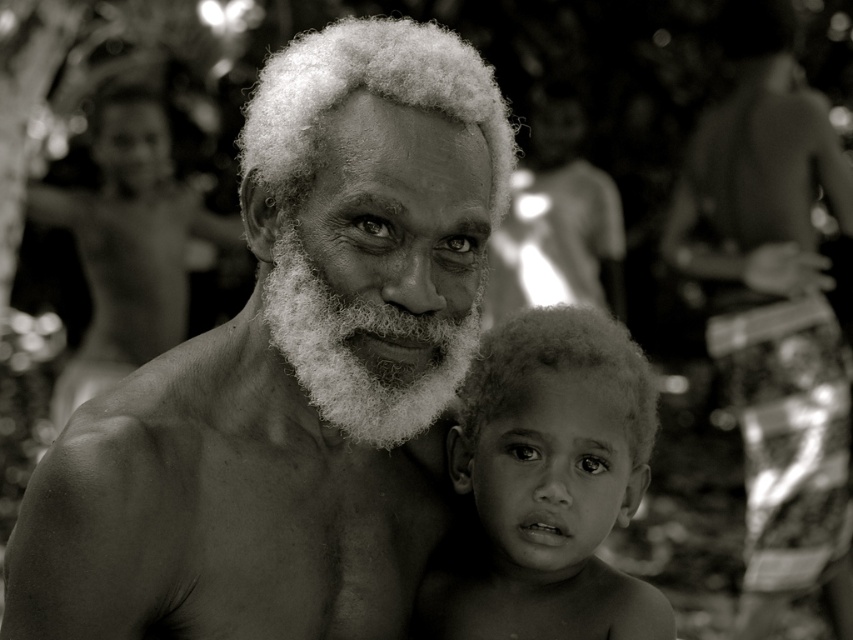
Is gray hair man at center smaller than curly hair at center?

No, gray hair man at center is not smaller than curly hair at center.

Find the location of `gray hair man at center`. gray hair man at center is located at coordinates (289, 371).

Is point (190, 518) positioned behind point (448, 556)?

That is False.

Find the location of a particular element. The height and width of the screenshot is (640, 853). gray hair man at center is located at coordinates (289, 371).

Does gray hair man at center appear on the right side of smooth skin at right?

No, gray hair man at center is not to the right of smooth skin at right.

You are a GUI agent. You are given a task and a screenshot of the screen. Output one action in this format:
    pyautogui.click(x=<x>, y=<y>)
    Task: Click on the gray hair man at center
    
    Given the screenshot: What is the action you would take?
    pyautogui.click(x=289, y=371)

Is point (45, 621) positioned in front of point (746, 12)?

Yes, point (45, 621) is in front of point (746, 12).

This screenshot has width=853, height=640. I want to click on gray hair man at center, so click(x=289, y=371).

Is curly hair at center to the right of white fluffy beard at center from the viewer's perspective?

Indeed, curly hair at center is positioned on the right side of white fluffy beard at center.

Does curly hair at center appear over white fluffy beard at center?

No, curly hair at center is not above white fluffy beard at center.

Is point (589, 593) farther from viewer compared to point (318, 388)?

That is True.

The image size is (853, 640). Find the location of `curly hair at center`. curly hair at center is located at coordinates (547, 486).